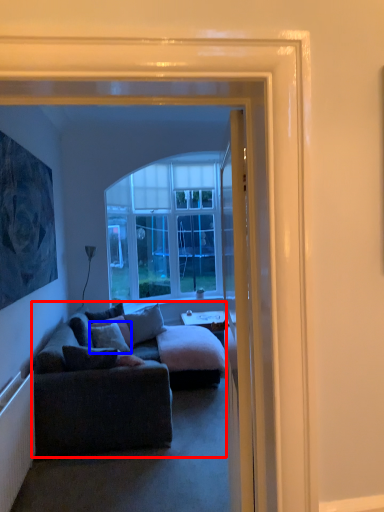
Question: Which object appears farthest to the camera in this image, studio couch (highlighted by a red box) or pillow (highlighted by a blue box)?

Choices:
 (A) studio couch
 (B) pillow

Answer: (B)